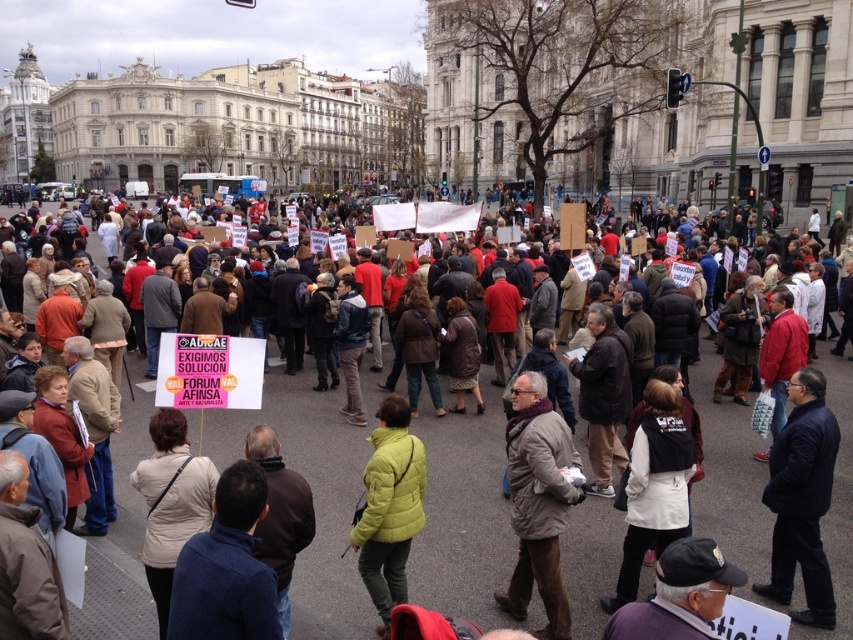
You are a photographer standing at the origin point of the image coordinate system. You want to capture the multicolored fabric crowd at center in your shot. What are the coordinates where you should aim your camera?

The coordinates where you should aim your camera are at point (x=312, y=488) to capture the multicolored fabric crowd at center.

You are a photographer trying to capture a photo of the matte yellow jacket at center without including the multicolored fabric crowd at center. Based on their positions, which direction should you move your camera to the left or right?

The multicolored fabric crowd at center is to the right of the matte yellow jacket at center. To avoid capturing the crowd, you should move your camera to the left so that the matte yellow jacket at center remains in frame while the crowd moves out of the shot to the right.